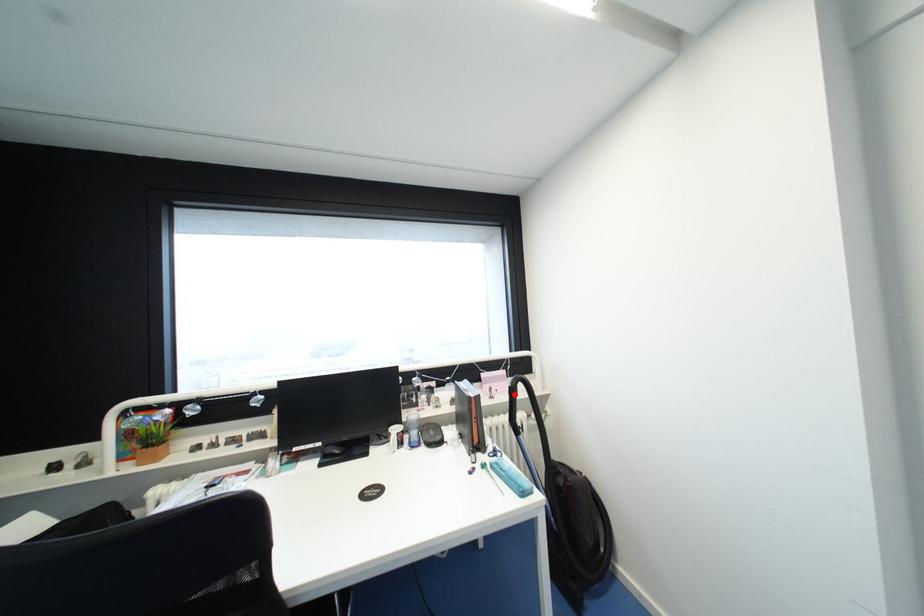
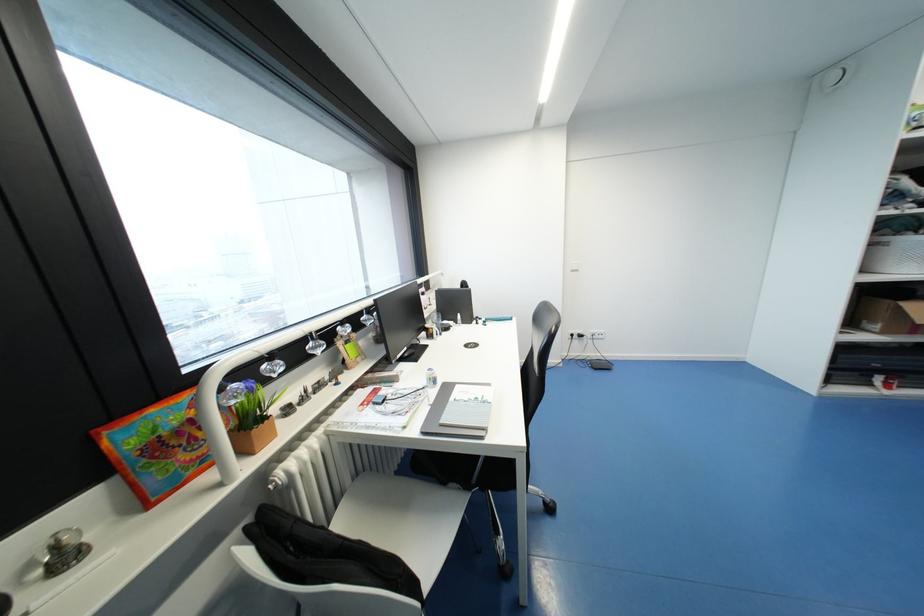
Question: I am providing you with two images of the same scene from different viewpoints. A red point is marked on the first image. Is the red point's position out of view in image 2?

Choices:
 (A) Yes
 (B) No

Answer: (A)